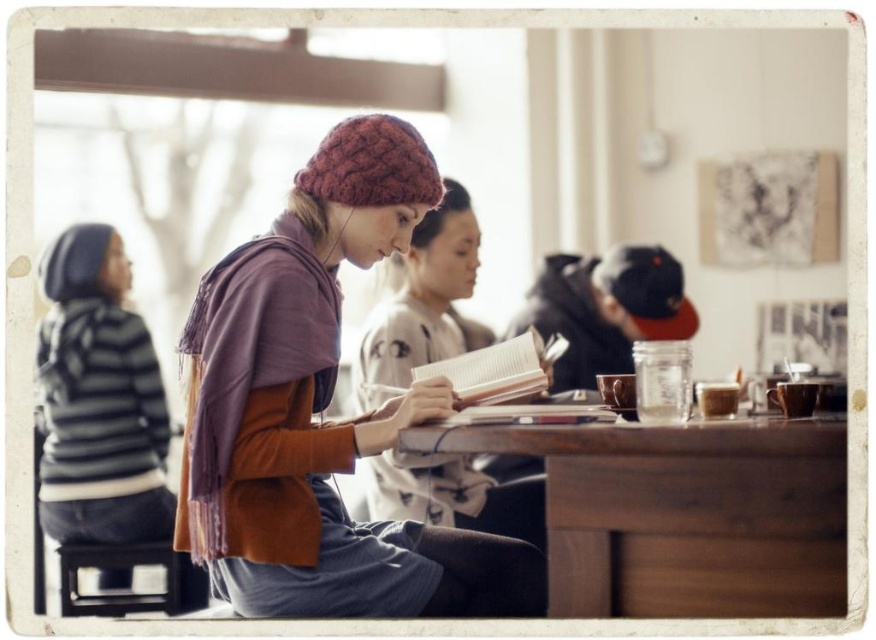
Who is positioned more to the right, wooden table at center or knitted wool beanie at center?

wooden table at center is more to the right.

Does wooden table at center have a greater width compared to knitted wool beanie at center?

Indeed, wooden table at center has a greater width compared to knitted wool beanie at center.

At what (x,y) coordinates should I click in order to perform the action: click on wooden table at center. Please return your answer as a coordinate pair (x, y). Looking at the image, I should click on (684, 515).

Can you confirm if wooden table at center is thinner than white paper book at center?

Incorrect, wooden table at center's width is not less than white paper book at center's.

Who is lower down, wooden table at center or white paper book at center?

wooden table at center is below.

Locate an element on the screen. The width and height of the screenshot is (876, 640). wooden table at center is located at coordinates (684, 515).

Is point (173, 608) in front of point (465, 358)?

No, it is behind (465, 358).

In order to click on dark brown wooden stool at lower left in this screenshot , I will do `click(131, 573)`.

Between point (139, 564) and point (493, 349), which one is positioned behind?

Point (139, 564)

This screenshot has height=640, width=876. Identify the location of dark brown wooden stool at lower left. (131, 573).